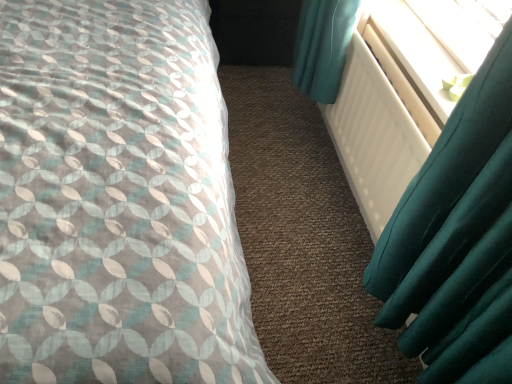
Find the location of a particular element. Image resolution: width=512 pixels, height=384 pixels. empty space that is ontop of white plastic radiator at upper right (from a real-world perspective) is located at coordinates (418, 51).